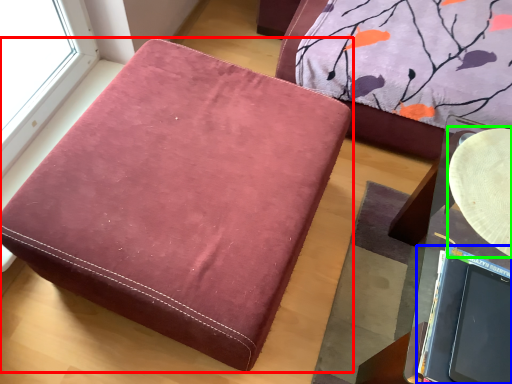
Question: Which object is the closest to the furniture (highlighted by a red box)? Choose among these: laptop (highlighted by a blue box) or round table (highlighted by a green box).

Choices:
 (A) laptop
 (B) round table

Answer: (A)